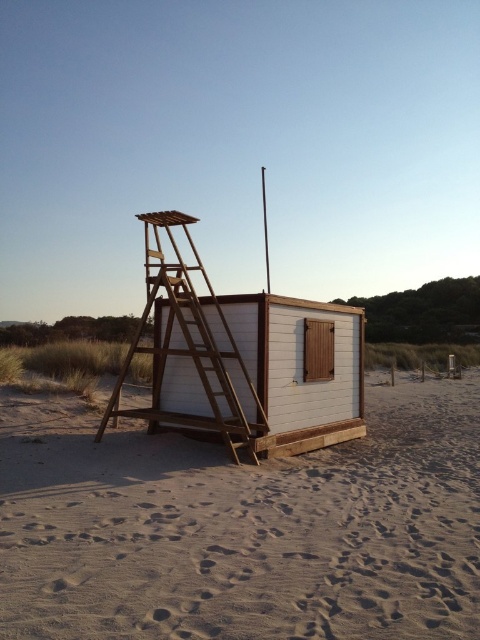
Question: Which point is closer to the camera taking this photo?

Choices:
 (A) (415, 493)
 (B) (330, 433)
 (C) (201, 323)

Answer: (A)

Question: Considering the relative positions of white wood beach hut at center and wooden ladder at center in the image provided, where is white wood beach hut at center located with respect to wooden ladder at center?

Choices:
 (A) above
 (B) below

Answer: (A)

Question: Which object appears farthest from the camera in this image?

Choices:
 (A) sandy beige at lower center
 (B) white wood beach hut at center

Answer: (B)

Question: Which point is farther to the camera?

Choices:
 (A) white wood beach hut at center
 (B) sandy beige at lower center

Answer: (A)

Question: Does sandy beige at lower center have a greater width compared to wooden ladder at center?

Choices:
 (A) no
 (B) yes

Answer: (B)

Question: Does white wood beach hut at center have a smaller size compared to wooden ladder at center?

Choices:
 (A) no
 (B) yes

Answer: (B)